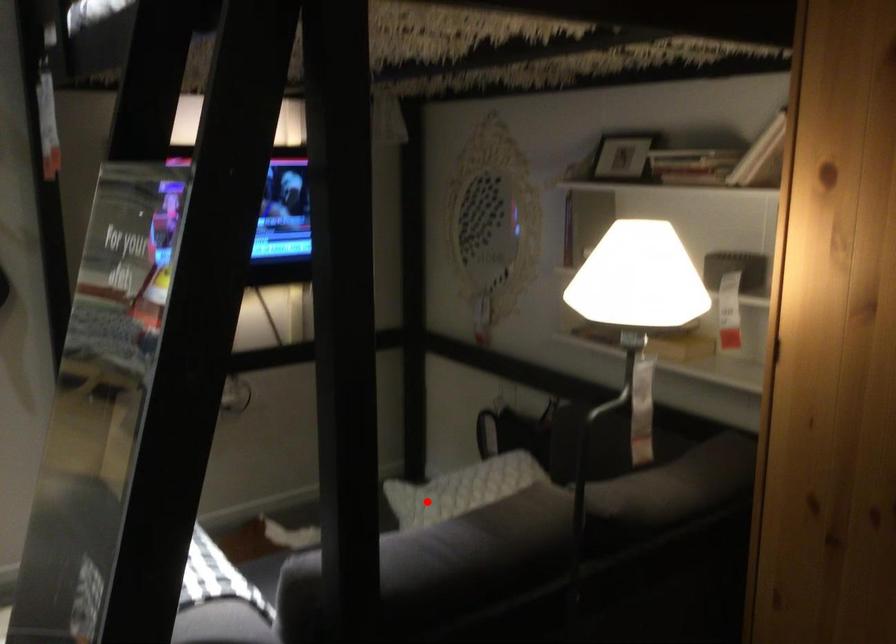
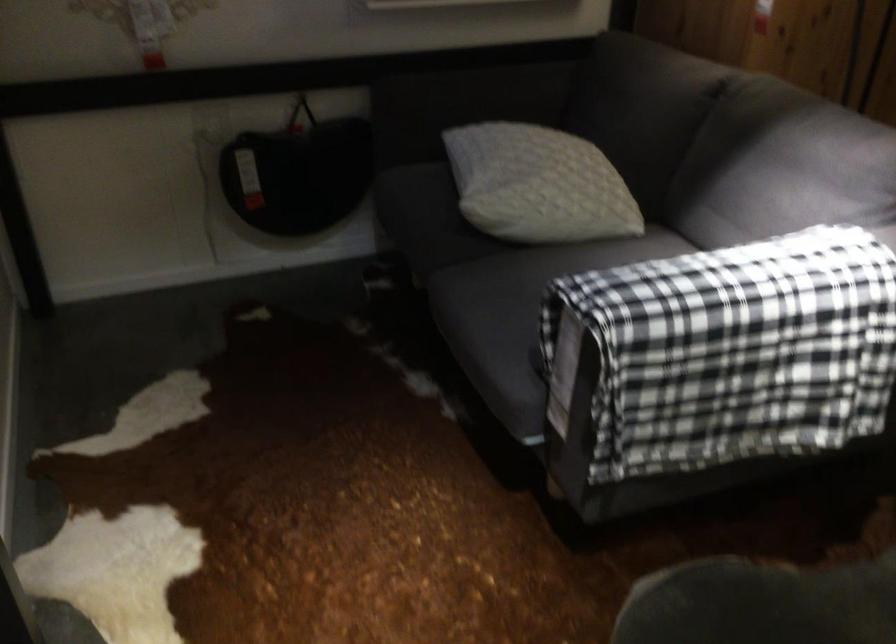
Question: I am providing you with two images of the same scene from different viewpoints. A red point is marked on the first image. At the location where the point appears in image 1, is it still visible in image 2?

Choices:
 (A) Yes
 (B) No

Answer: (A)